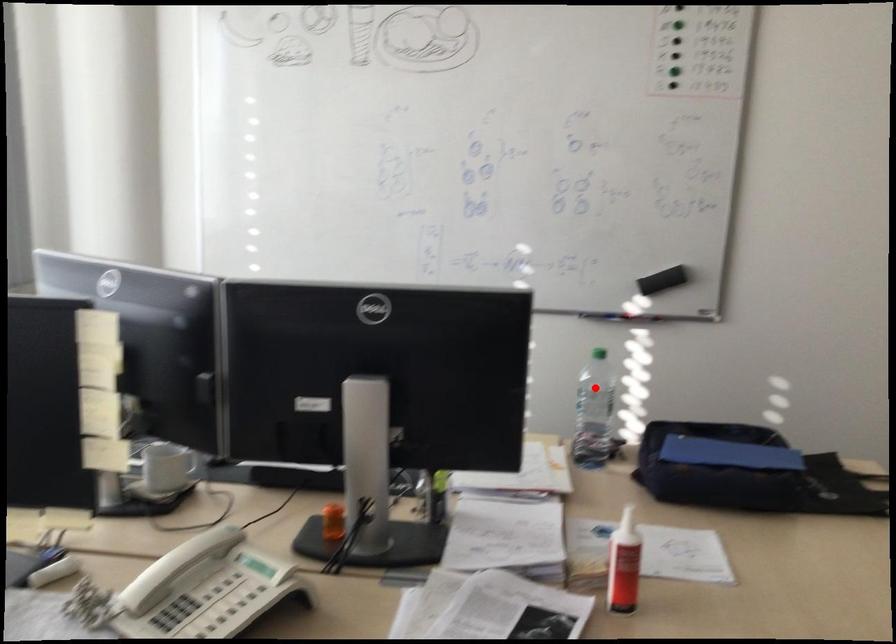
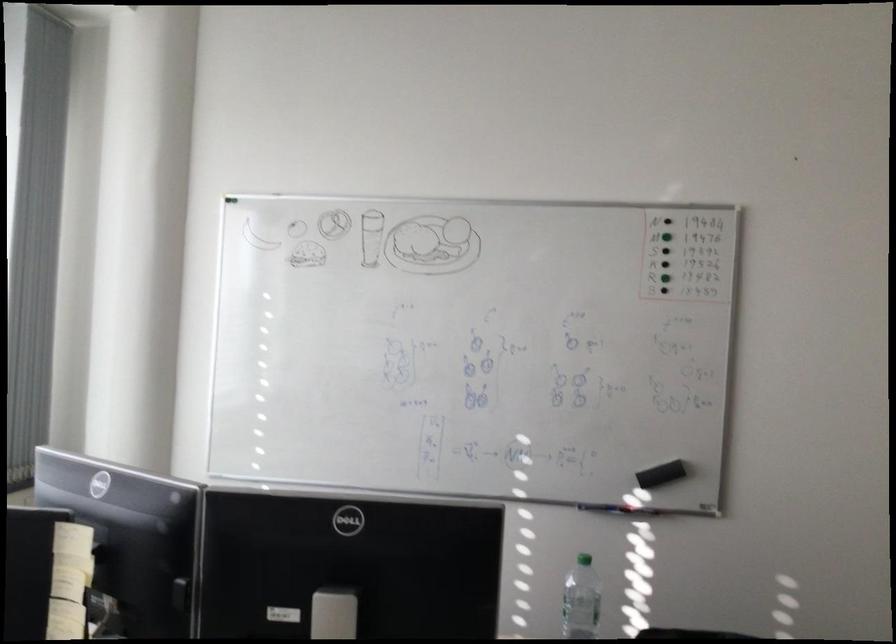
The point at the highlighted location is marked in the first image. Where is the corresponding point in the second image?

(581, 600)